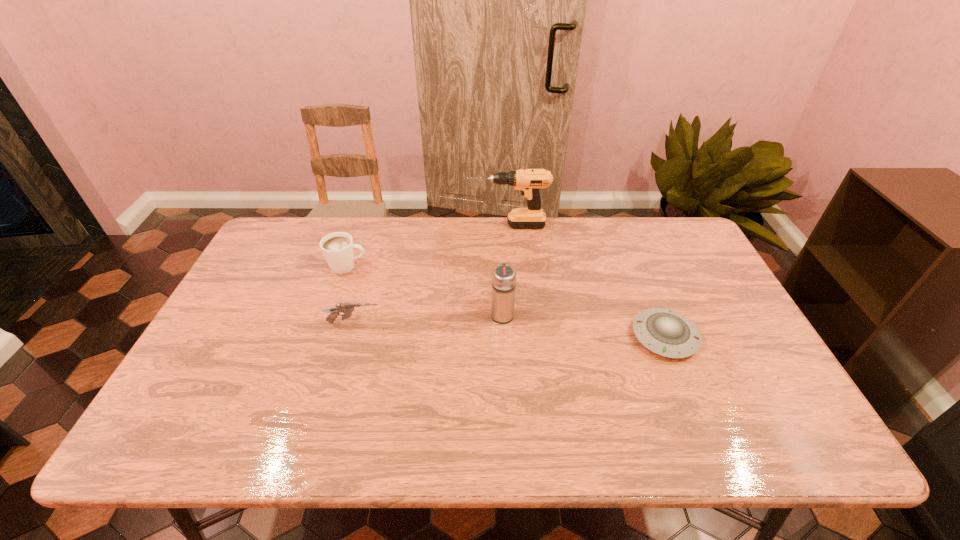
Identify the location of free space that satisfies the following two spatial constraints: 1. at the barrel of the gun; 2. on the back side of the saucer. click(x=349, y=337).